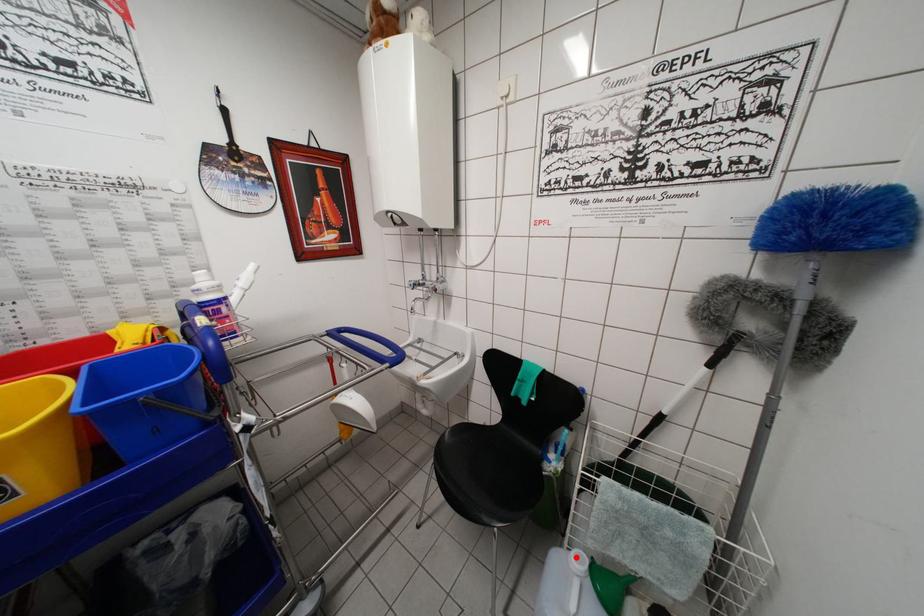
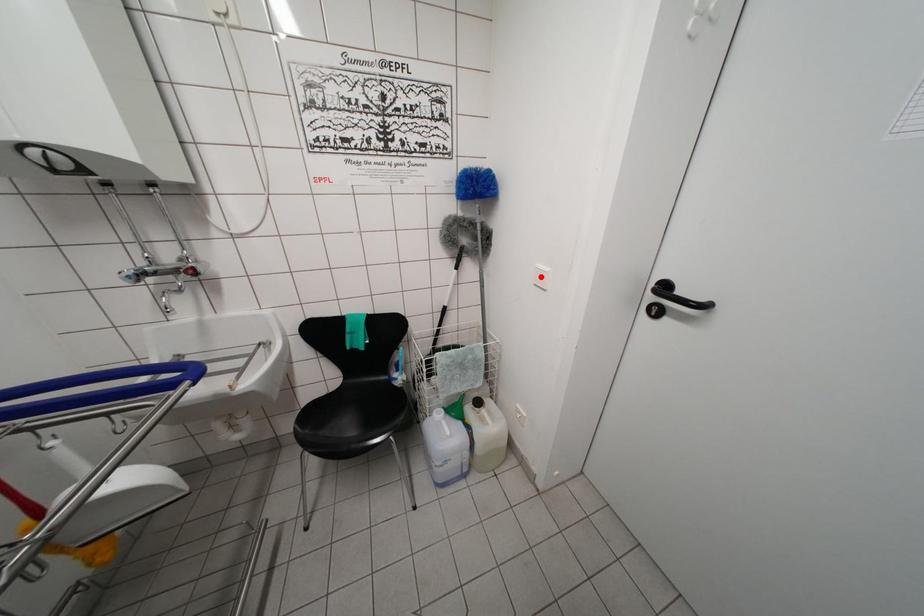
I am providing you with two images of the same scene from different viewpoints. A red point is marked on the first image and another point is marked on the second image. Is the red point in image1 aligned with the point shown in image2?

No